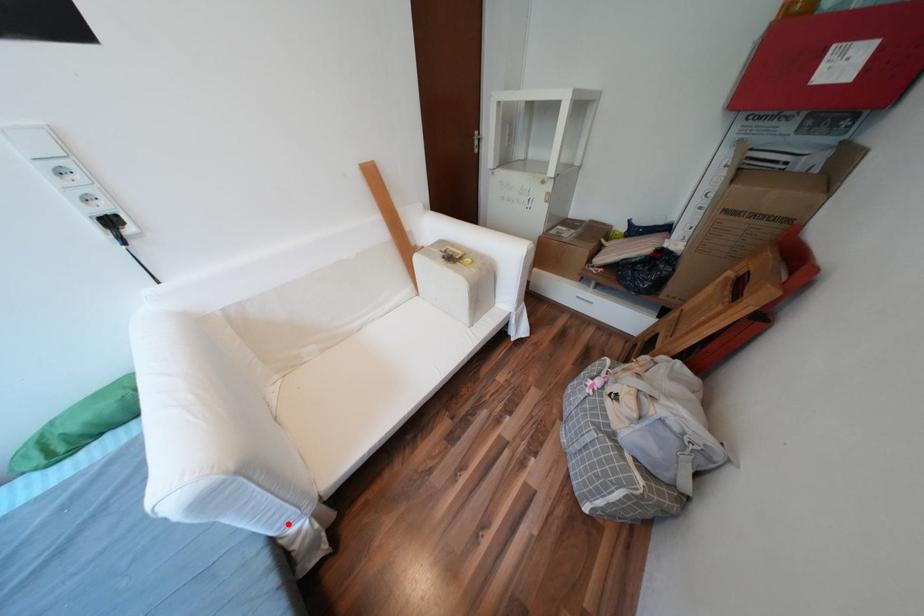
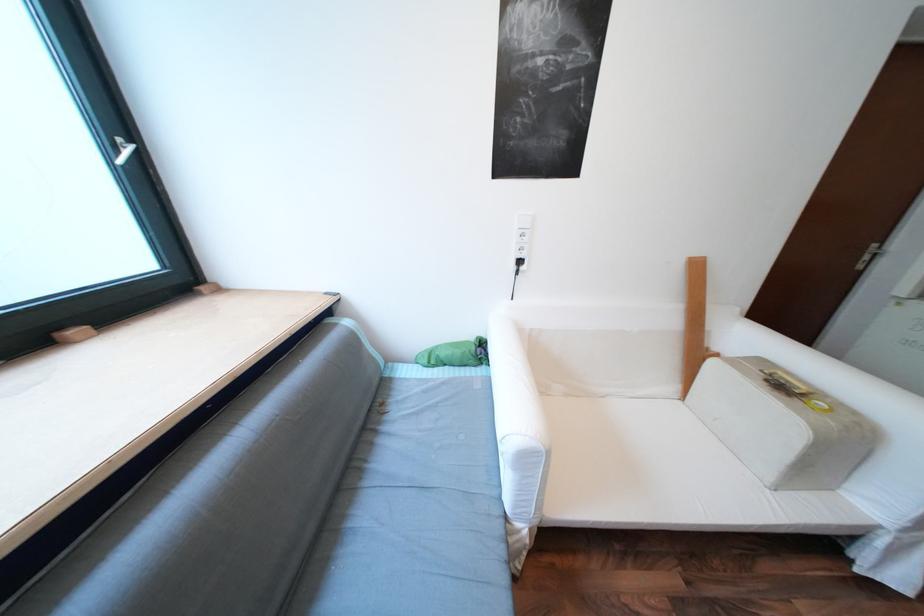
Question: I am providing you with two images of the same scene from different viewpoints. In image1, a red point is highlighted. Considering the same 3D point in image2, which of the following is correct?

Choices:
 (A) It is closer
 (B) It is farther

Answer: (B)